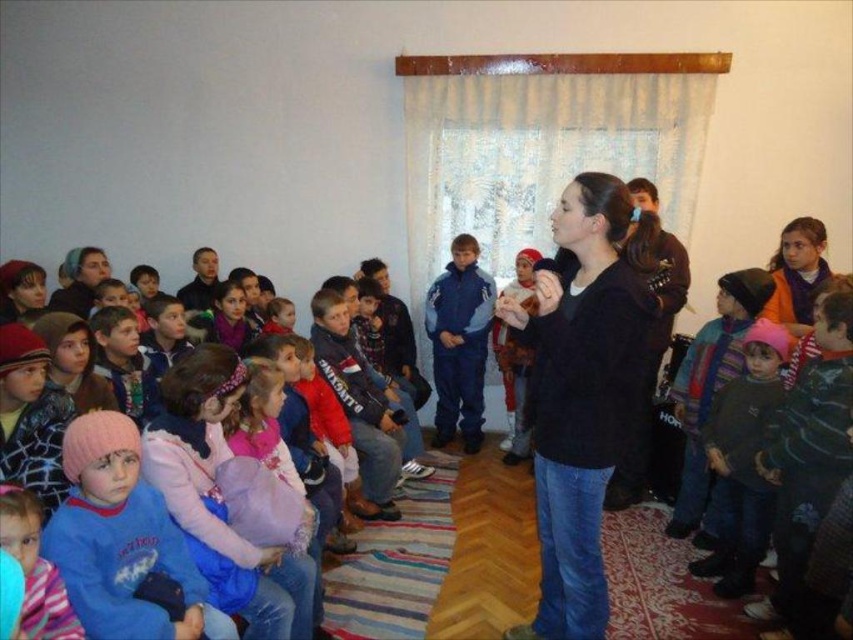
Question: Considering the real-world distances, which object is farthest from the black matte shirt at center?

Choices:
 (A) pink fleece hat at center
 (B) pink woolen hats at left
 (C) blue fleece jacket at center
 (D) pink fleece jacket at lower left

Answer: (C)

Question: Does pink fleece hat at center have a greater width compared to blue fleece jacket at center?

Choices:
 (A) no
 (B) yes

Answer: (A)

Question: Which object is closer to the camera taking this photo?

Choices:
 (A) black matte shirt at center
 (B) pink woolen hats at left
 (C) pink fleece jacket at lower left

Answer: (C)

Question: Can you confirm if black matte shirt at center is wider than pink woolen hats at left?

Choices:
 (A) yes
 (B) no

Answer: (B)

Question: Is pink woolen hats at left further to the viewer compared to pink fleece hat at center?

Choices:
 (A) yes
 (B) no

Answer: (B)

Question: Which of the following is the farthest from the observer?

Choices:
 (A) pink fleece hat at center
 (B) pink fleece jacket at lower left
 (C) black matte shirt at center

Answer: (A)